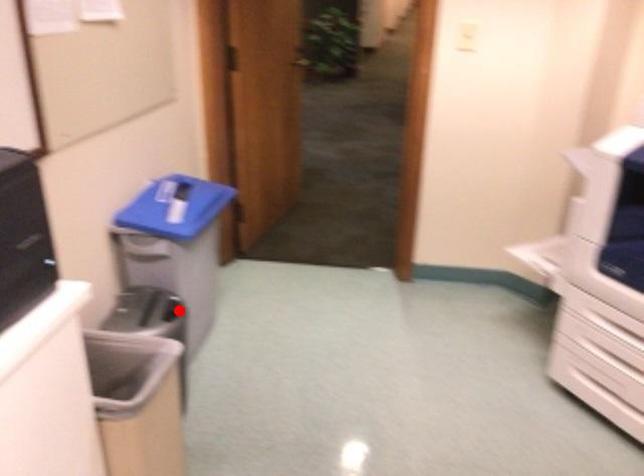
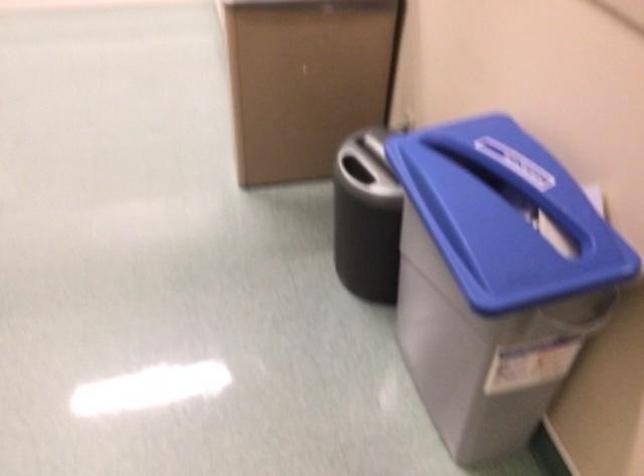
Question: I am providing you with two images of the same scene from different viewpoints. A red point is marked on the first image. At the location where the point appears in image 1, is it still visible in image 2?

Choices:
 (A) Yes
 (B) No

Answer: (A)